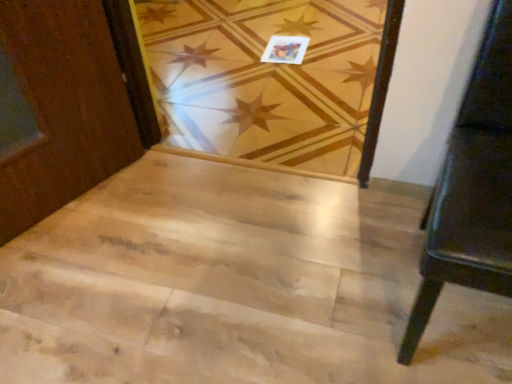
Question: Is natural wood stairwell at center oriented towards black leather bench at right?

Choices:
 (A) no
 (B) yes

Answer: (A)

Question: Can you confirm if natural wood stairwell at center is smaller than black leather bench at right?

Choices:
 (A) yes
 (B) no

Answer: (A)

Question: From a real-world perspective, does natural wood stairwell at center sit lower than black leather bench at right?

Choices:
 (A) no
 (B) yes

Answer: (B)

Question: Considering the relative sizes of natural wood stairwell at center and black leather bench at right in the image provided, is natural wood stairwell at center wider than black leather bench at right?

Choices:
 (A) no
 (B) yes

Answer: (B)

Question: Can you confirm if natural wood stairwell at center is positioned to the right of black leather bench at right?

Choices:
 (A) yes
 (B) no

Answer: (B)

Question: Is natural wood stairwell at center far away from black leather bench at right?

Choices:
 (A) yes
 (B) no

Answer: (B)

Question: Considering the relative sizes of natural wood stairwell at center and matte paper postcard at upper center in the image provided, is natural wood stairwell at center bigger than matte paper postcard at upper center?

Choices:
 (A) no
 (B) yes

Answer: (B)

Question: Does natural wood stairwell at center have a greater width compared to matte paper postcard at upper center?

Choices:
 (A) yes
 (B) no

Answer: (A)

Question: Considering the relative sizes of natural wood stairwell at center and matte paper postcard at upper center in the image provided, is natural wood stairwell at center shorter than matte paper postcard at upper center?

Choices:
 (A) yes
 (B) no

Answer: (B)

Question: Is natural wood stairwell at center thinner than matte paper postcard at upper center?

Choices:
 (A) no
 (B) yes

Answer: (A)

Question: Is natural wood stairwell at center positioned beyond the bounds of matte paper postcard at upper center?

Choices:
 (A) no
 (B) yes

Answer: (B)

Question: Considering the relative positions of natural wood stairwell at center and matte paper postcard at upper center in the image provided, is natural wood stairwell at center to the right of matte paper postcard at upper center from the viewer's perspective?

Choices:
 (A) yes
 (B) no

Answer: (B)

Question: Is matte paper postcard at upper center positioned in front of natural wood floor at center?

Choices:
 (A) no
 (B) yes

Answer: (A)